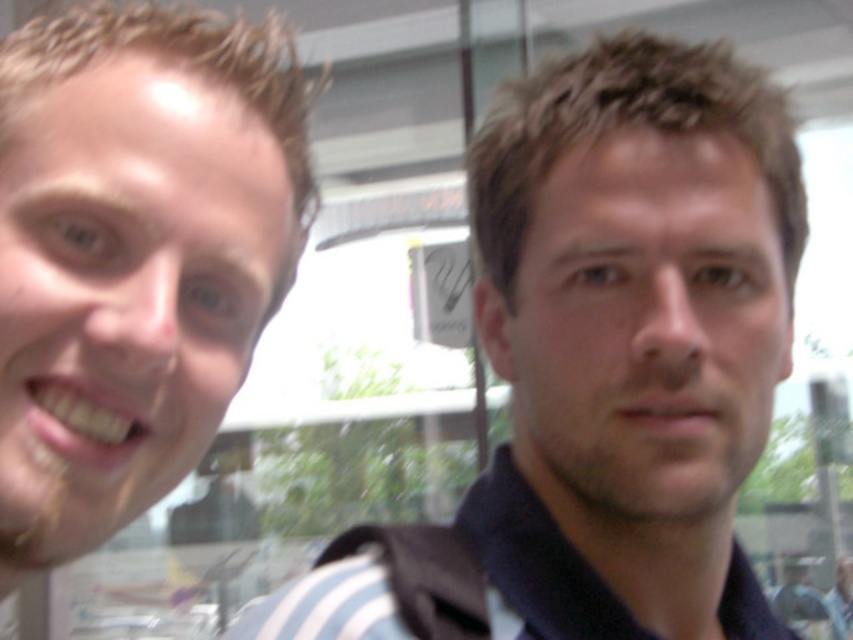
Does brown hair at right appear on the right side of smooth skin face at left?

Indeed, brown hair at right is positioned on the right side of smooth skin face at left.

Does brown hair at right have a lesser width compared to smooth skin face at left?

No, brown hair at right is not thinner than smooth skin face at left.

Where is `brown hair at right`? The image size is (853, 640). brown hair at right is located at coordinates coord(631,333).

Locate an element on the screen. This screenshot has height=640, width=853. brown hair at right is located at coordinates (631, 333).